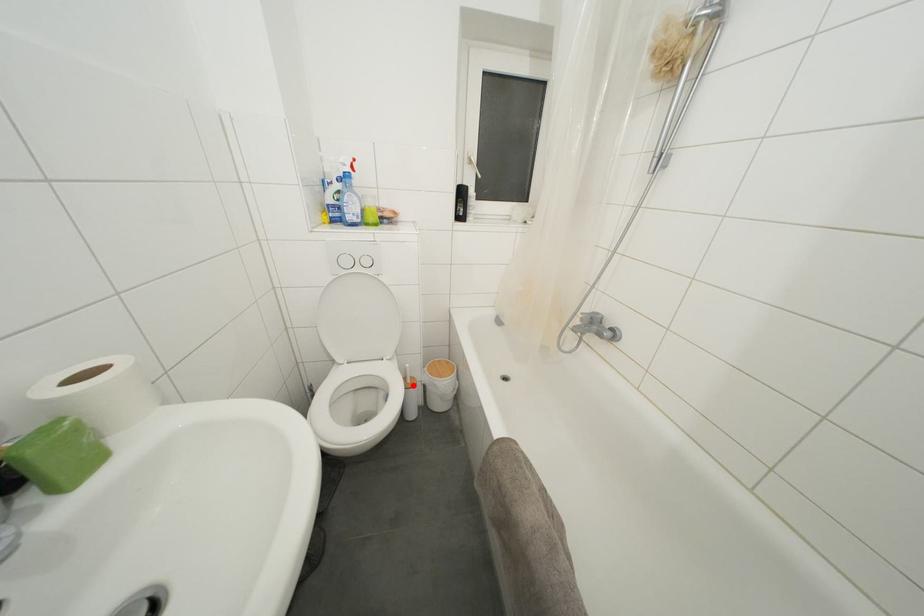
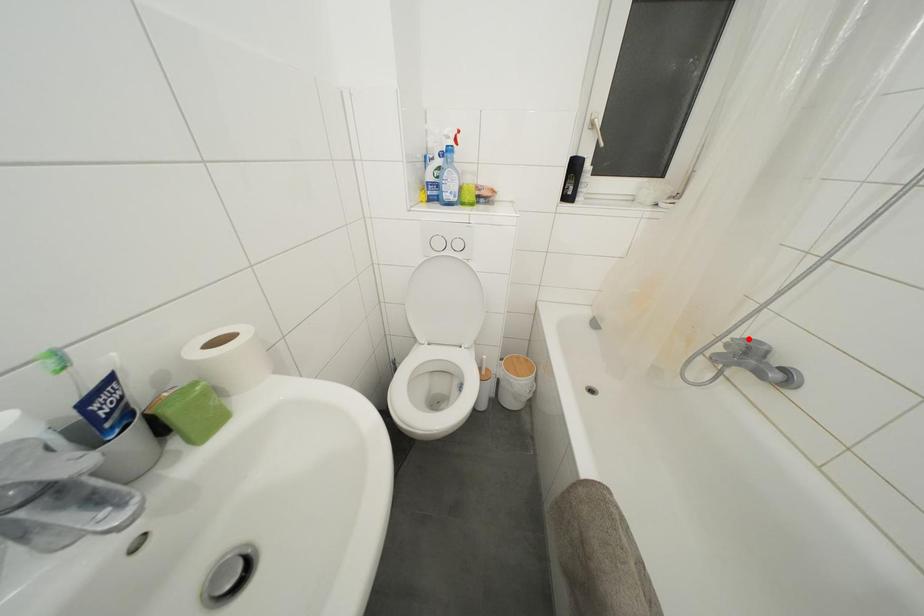
I am providing you with two images of the same scene from different viewpoints. A red point is marked on the first image and another point is marked on the second image. Does the point marked in image1 correspond to the same location as the one in image2?

No